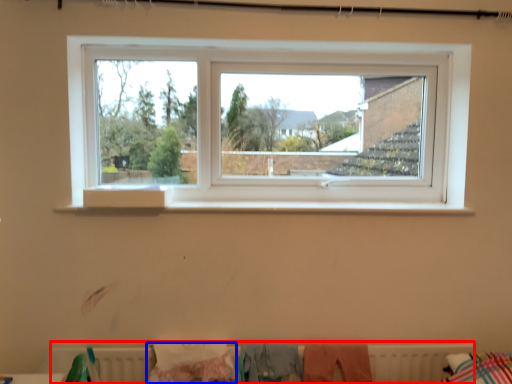
Question: Which of the following is the closest to the observer, radiator (highlighted by a red box) or clothing (highlighted by a blue box)?

Choices:
 (A) radiator
 (B) clothing

Answer: (B)